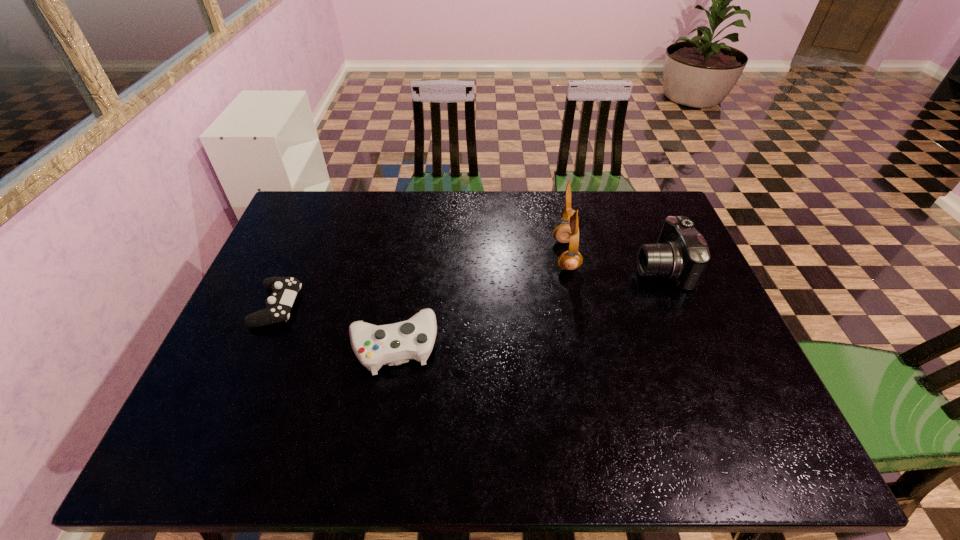
Find the location of `free region located on the front-facing side of the earphone`. free region located on the front-facing side of the earphone is located at coordinates (461, 255).

Image resolution: width=960 pixels, height=540 pixels. Find the location of `free space located on the lens of the rightmost object`. free space located on the lens of the rightmost object is located at coordinates (509, 267).

The height and width of the screenshot is (540, 960). Find the location of `blank area located on the lens of the rightmost object`. blank area located on the lens of the rightmost object is located at coordinates (612, 267).

This screenshot has width=960, height=540. I want to click on vacant region located 0.350m on the lens of the rightmost object, so click(x=516, y=267).

This screenshot has height=540, width=960. I want to click on vacant position located on the back of the third object from right to left, so click(x=413, y=230).

Find the location of `vacant space situated on the surface of the shortest object`. vacant space situated on the surface of the shortest object is located at coordinates (335, 306).

Locate an element on the screen. The width and height of the screenshot is (960, 540). object situated at the left edge is located at coordinates (285, 289).

Find the location of a particular element. The height and width of the screenshot is (540, 960). object located in the right edge section of the desktop is located at coordinates pos(681,254).

I want to click on vacant space at the far edge of the desktop, so click(x=534, y=230).

Where is `free space at the near edge`? The width and height of the screenshot is (960, 540). free space at the near edge is located at coordinates (335, 432).